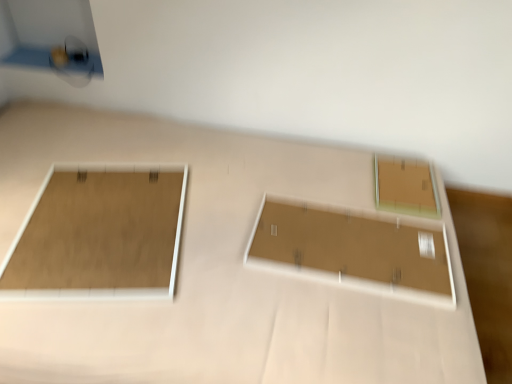
Question: Is matte brown frame at left, which ranks as the 1th rectangle in left-to-right order, taller or shorter than matte brown frame at upper right, marked as the third rectangle in a left-to-right arrangement?

Choices:
 (A) short
 (B) tall

Answer: (A)

Question: From the image's perspective, is matte brown frame at left, which ranks as the 1th rectangle in left-to-right order, above or below matte brown frame at upper right, acting as the first rectangle starting from the right?

Choices:
 (A) above
 (B) below

Answer: (B)

Question: Which object is positioned farthest from the matte brown board at center, arranged as the second rectangle when viewed from the right?

Choices:
 (A) matte brown frame at left, which ranks as the 1th rectangle in left-to-right order
 (B) matte brown frame at upper right, marked as the third rectangle in a left-to-right arrangement

Answer: (A)

Question: Based on their relative distances, which object is farther from the matte brown frame at upper right, marked as the third rectangle in a left-to-right arrangement?

Choices:
 (A) matte brown board at center, arranged as the second rectangle when viewed from the right
 (B) matte brown frame at left, which ranks as the 1th rectangle in left-to-right order

Answer: (B)